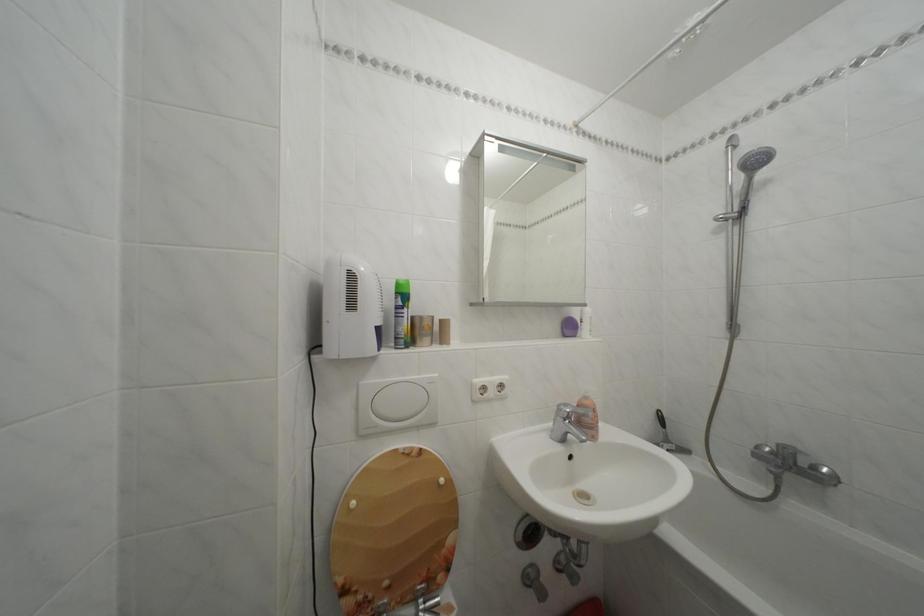
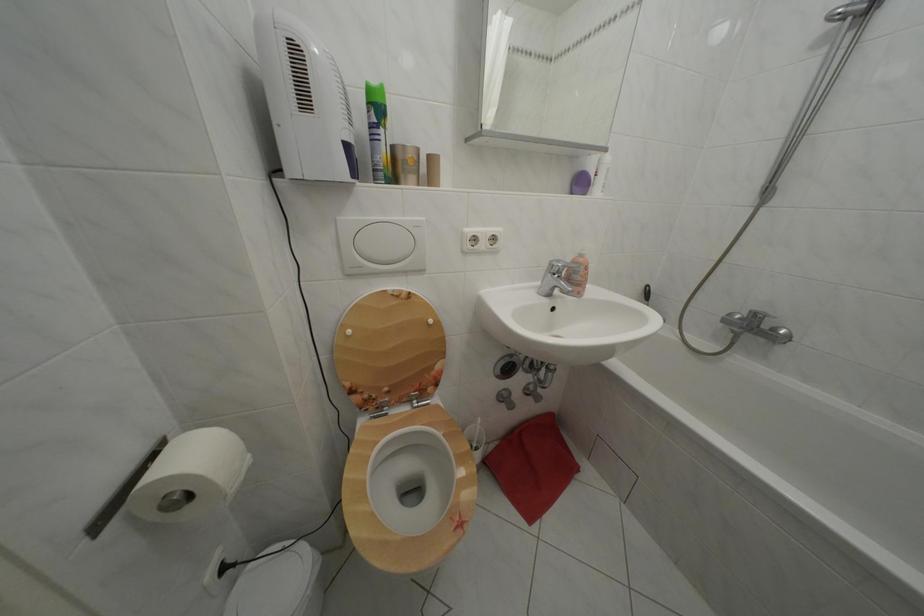
Where in the second image is the point corresponding to pixel 371 389 from the first image?

(348, 225)